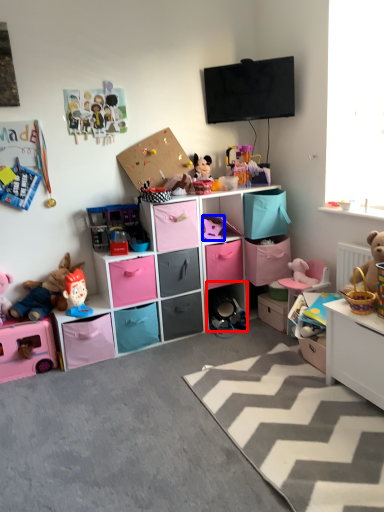
Question: Which object appears farthest to the camera in this image, cabinet (highlighted by a red box) or toy (highlighted by a blue box)?

Choices:
 (A) cabinet
 (B) toy

Answer: (A)